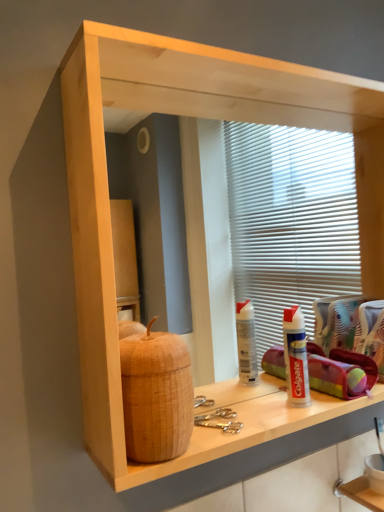
The image size is (384, 512). What do you see at coordinates (360, 493) in the screenshot?
I see `white wood shelf at lower right` at bounding box center [360, 493].

Image resolution: width=384 pixels, height=512 pixels. Find the location of `brown woven basket at left`. brown woven basket at left is located at coordinates (156, 395).

What do you see at coordinates (340, 372) in the screenshot? I see `white plastic toothpaste tube at lower right` at bounding box center [340, 372].

Locate an element on the screen. white wood shelf at lower right is located at coordinates (360, 493).

What's the angular difference between white plastic toothpaste tube at lower right and white wood shelf at lower right's facing directions?

There is a 0.00117-degree angle between the facing directions of white plastic toothpaste tube at lower right and white wood shelf at lower right.

Is white plastic toothpaste tube at lower right to the right of white wood shelf at lower right from the viewer's perspective?

No.

You are a GUI agent. You are given a task and a screenshot of the screen. Output one action in this format:
    pyautogui.click(x=<x>, y=<y>)
    Task: Click on the shelf that is under the white plastic toothpaste tube at lower right (from a real-world perspective)
    This screenshot has height=512, width=384.
    Given the screenshot: What is the action you would take?
    pyautogui.click(x=360, y=493)

Is white plastic toothpaste tube at lower right thinner than white wood shelf at lower right?

Correct, the width of white plastic toothpaste tube at lower right is less than that of white wood shelf at lower right.

From the picture: Which is in front, brown woven basket at left or white wood shelf at lower right?

Positioned in front is brown woven basket at left.

Looking at this image, is brown woven basket at left touching white wood shelf at lower right?

No, brown woven basket at left is not with white wood shelf at lower right.

Looking at this image, which is more to the right, brown woven basket at left or white wood shelf at lower right?

From the viewer's perspective, white wood shelf at lower right appears more on the right side.

Can you confirm if brown woven basket at left is shorter than white wood shelf at lower right?

No.

From a real-world perspective, which object stands above the other?

In real-world perspective, brown woven basket at left is above.

Can you confirm if brown woven basket at left is positioned to the right of white plastic toothpaste tube at lower right?

Incorrect, brown woven basket at left is not on the right side of white plastic toothpaste tube at lower right.

Is brown woven basket at left positioned with its back to white plastic toothpaste tube at lower right?

No.

Is white plastic toothpaste tube at lower right located within brown woven basket at left?

No, white plastic toothpaste tube at lower right is not surrounded by brown woven basket at left.

Consider the image. Which of these two, white wood shelf at lower right or brown woven basket at left, stands taller?

With more height is brown woven basket at left.

Is the position of white wood shelf at lower right less distant than that of brown woven basket at left?

No, the depth of white wood shelf at lower right is greater than that of brown woven basket at left.

Does white wood shelf at lower right have a greater width compared to brown woven basket at left?

Yes.

From the image's perspective, which is above, white wood shelf at lower right or brown woven basket at left?

brown woven basket at left appears higher in the image.

Is white plastic toothpaste tube at lower right at the left side of brown woven basket at left?

Incorrect, white plastic toothpaste tube at lower right is not on the left side of brown woven basket at left.

Is white plastic toothpaste tube at lower right facing towards brown woven basket at left?

No, white plastic toothpaste tube at lower right is not aimed at brown woven basket at left.

Would you say white plastic toothpaste tube at lower right is inside or outside brown woven basket at left?

white plastic toothpaste tube at lower right exists outside the volume of brown woven basket at left.

In terms of height, does white plastic toothpaste tube at lower right look taller or shorter compared to brown woven basket at left?

Clearly, white plastic toothpaste tube at lower right is shorter compared to brown woven basket at left.

Is white wood shelf at lower right situated inside white plastic toothpaste tube at lower right or outside?

white wood shelf at lower right exists outside the volume of white plastic toothpaste tube at lower right.

Is white wood shelf at lower right with white plastic toothpaste tube at lower right?

No, white wood shelf at lower right is not making contact with white plastic toothpaste tube at lower right.

The width and height of the screenshot is (384, 512). I want to click on material located above the white wood shelf at lower right (from a real-world perspective), so click(x=340, y=372).

Looking at this image, from the image's perspective, between white wood shelf at lower right and white plastic toothpaste tube at lower right, who is located below?

From the image's view, white wood shelf at lower right is below.

Identify the location of shelf located on the right of white plastic toothpaste tube at lower right. (360, 493).

What are the coordinates of `basket above the white wood shelf at lower right (from the image's perspective)` in the screenshot? It's located at (156, 395).

When comparing their distances from white wood shelf at lower right, does brown woven basket at left or white plastic toothpaste tube at lower right seem closer?

white plastic toothpaste tube at lower right is closer to white wood shelf at lower right.

Which object lies further to the anchor point white wood shelf at lower right, white plastic toothpaste tube at lower right or brown woven basket at left?

brown woven basket at left.

When comparing their distances from brown woven basket at left, does white plastic toothpaste tube at lower right or white wood shelf at lower right seem further?

white wood shelf at lower right is further to brown woven basket at left.

Based on the photo, when comparing their distances from white plastic toothpaste tube at lower right, does white wood shelf at lower right or brown woven basket at left seem further?

brown woven basket at left is further to white plastic toothpaste tube at lower right.

Which object lies nearer to the anchor point white plastic toothpaste tube at lower right, brown woven basket at left or white wood shelf at lower right?

white wood shelf at lower right is positioned closer to the anchor white plastic toothpaste tube at lower right.

In the scene shown: Which object lies nearer to the anchor point brown woven basket at left, white wood shelf at lower right or white plastic toothpaste tube at lower right?

The object closer to brown woven basket at left is white plastic toothpaste tube at lower right.

Locate an element on the screen. The image size is (384, 512). material between brown woven basket at left and white wood shelf at lower right from left to right is located at coordinates (340, 372).